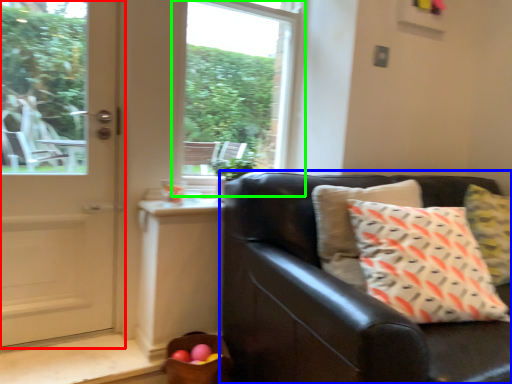
Question: Based on their relative distances, which object is farther from door (highlighted by a red box)? Choose from studio couch (highlighted by a blue box) and window (highlighted by a green box).

Choices:
 (A) studio couch
 (B) window

Answer: (A)